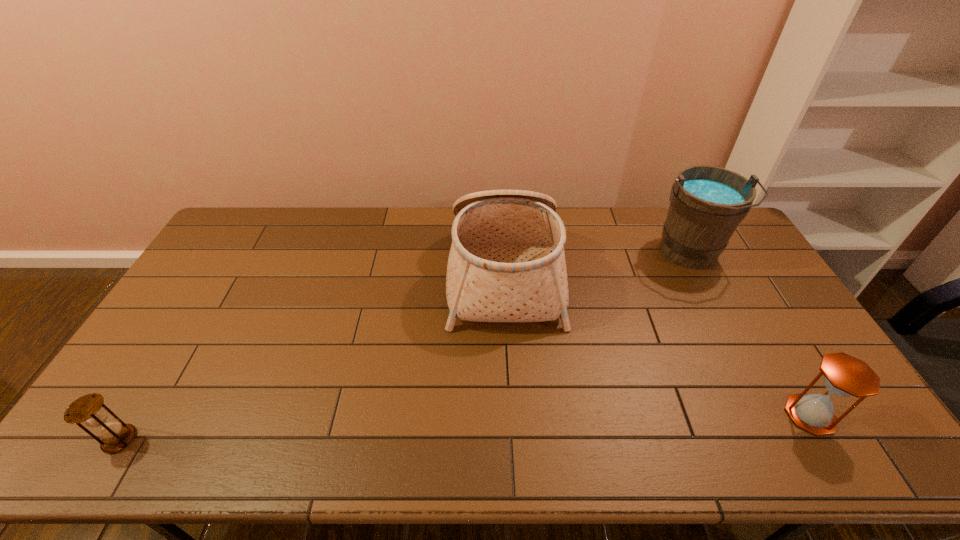
Locate an element on the screen. free space that is in between the taller hourglass and the third object from right to left is located at coordinates (657, 343).

I want to click on vacant area between the wine bucket and the left hourglass, so click(404, 347).

Where is `empty location between the third tallest object and the shortest object`? This screenshot has height=540, width=960. empty location between the third tallest object and the shortest object is located at coordinates (465, 427).

Find the location of a particular element. The height and width of the screenshot is (540, 960). empty location between the right hourglass and the wine bucket is located at coordinates [x=750, y=335].

Where is `the second closest object to the right hourglass`? The height and width of the screenshot is (540, 960). the second closest object to the right hourglass is located at coordinates (507, 263).

Identify which object is located as the third nearest to the second object from left to right. Please provide its 2D coordinates. Your answer should be formatted as a tuple, i.e. [(x, y)], where the tuple contains the x and y coordinates of a point satisfying the conditions above.

[(90, 409)]

The width and height of the screenshot is (960, 540). Identify the location of vacant space that satisfies the following two spatial constraints: 1. with a handle on the side of the wine bucket; 2. on the left side of the right hourglass. (772, 415).

Find the location of a particular element. The width and height of the screenshot is (960, 540). vacant point that satisfies the following two spatial constraints: 1. with the lid open on the basket; 2. on the back side of the right hourglass is located at coordinates (513, 415).

Find the location of a particular element. free spot that satisfies the following two spatial constraints: 1. with a handle on the side of the wine bucket; 2. with the lid open on the basket is located at coordinates (698, 272).

The width and height of the screenshot is (960, 540). I want to click on vacant area that satisfies the following two spatial constraints: 1. with a handle on the side of the third tallest object; 2. on the right side of the wine bucket, so click(772, 415).